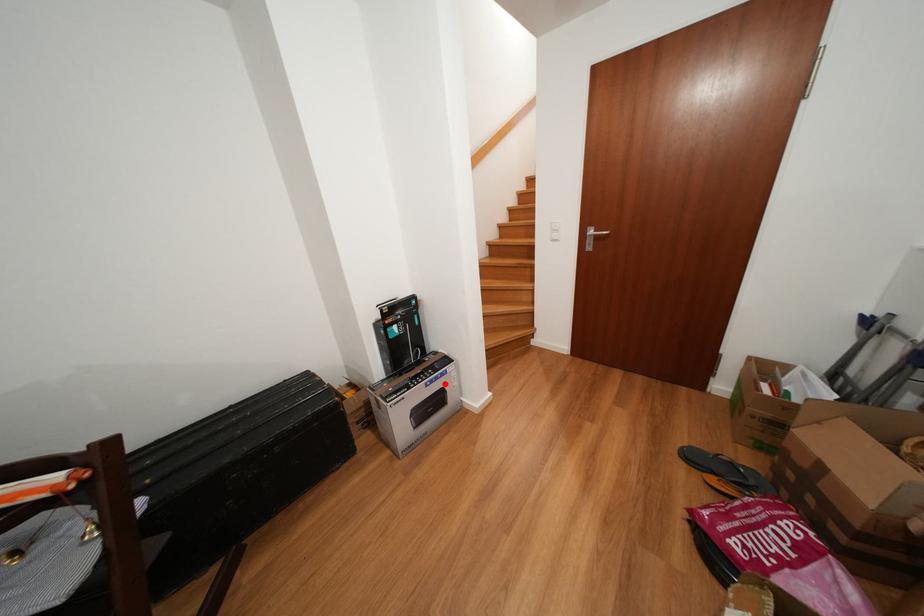
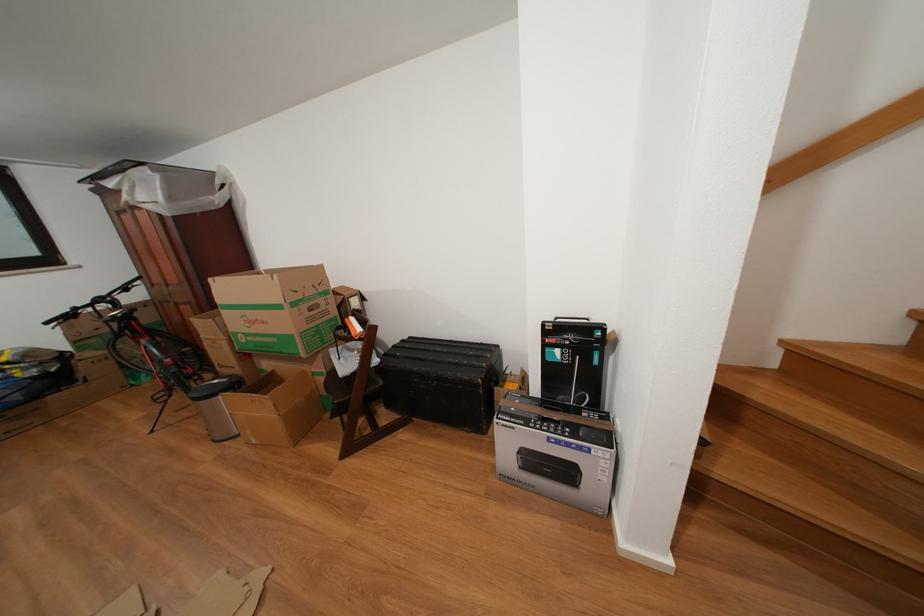
Where in the second image is the point corresponding to the highlighted location from the first image?

(576, 450)